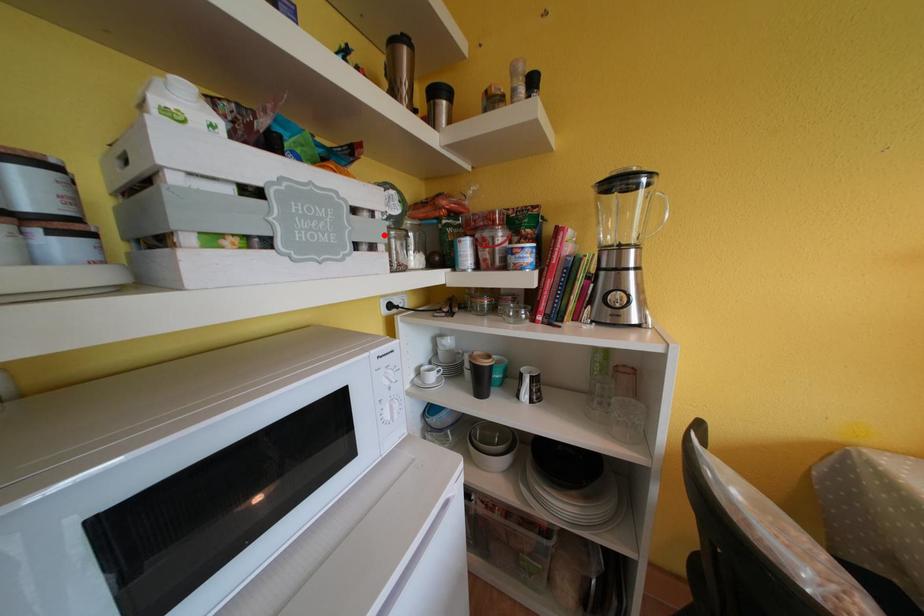
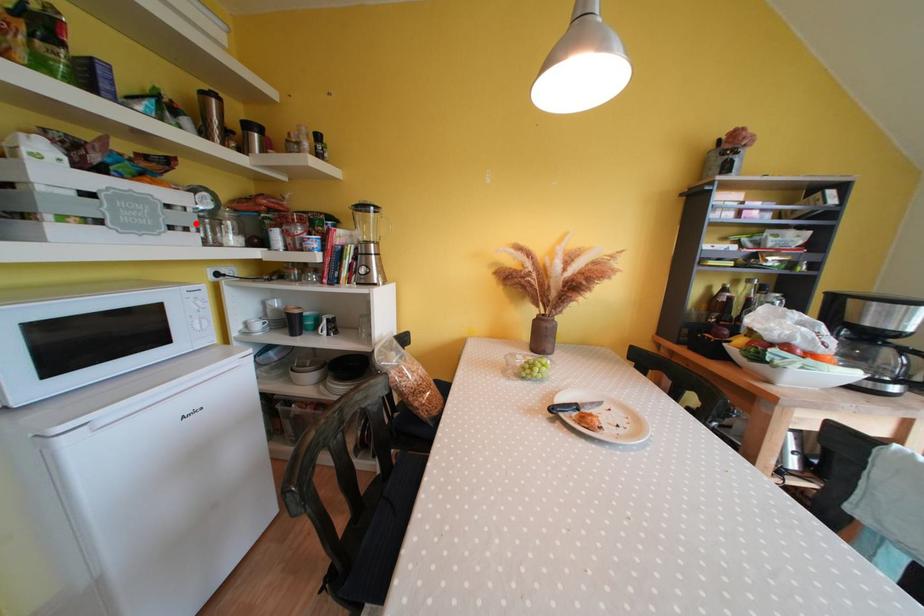
I am providing you with two images of the same scene from different viewpoints. A red point is marked on the first image and another point is marked on the second image. Are the points marked in image1 and image2 representing the same 3D position?

Yes